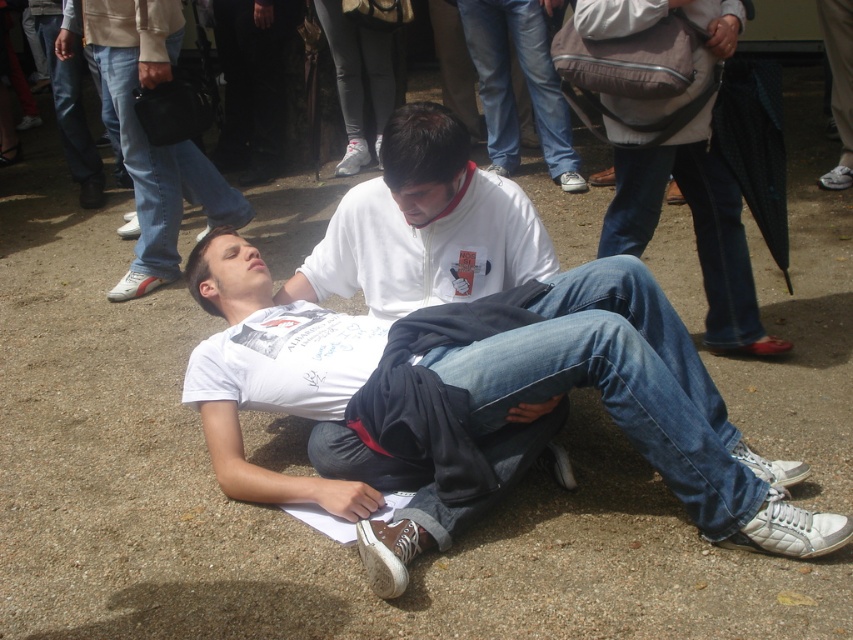
You are a delivery person who needs to place a small package between the matte brown backpack at center and the white matte shirt at center. Since the backpack is shorter than the shirt, will the package be placed closer to the backpack or the shirt?

The matte brown backpack at center has a lesser height compared to the white matte shirt at center, so the package should be placed closer to the backpack to ensure stability as it is shorter and less likely to tip over.